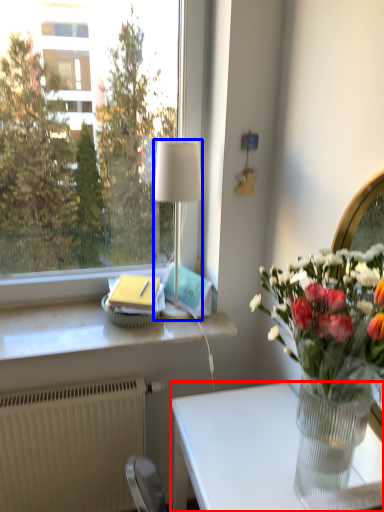
Question: Which object is further to the camera taking this photo, desk (highlighted by a red box) or lamp (highlighted by a blue box)?

Choices:
 (A) desk
 (B) lamp

Answer: (B)